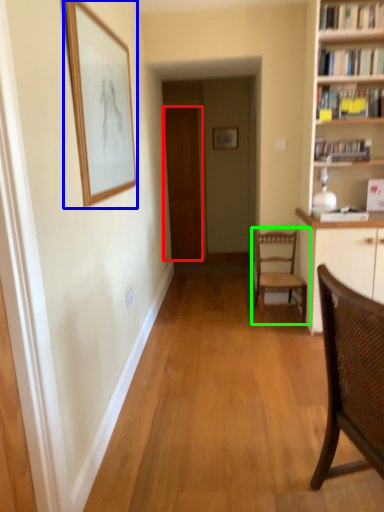
Question: Estimate the real-world distances between objects in this image. Which object is closer to door (highlighted by a red box), picture frame (highlighted by a blue box) or chair (highlighted by a green box)?

Choices:
 (A) picture frame
 (B) chair

Answer: (B)